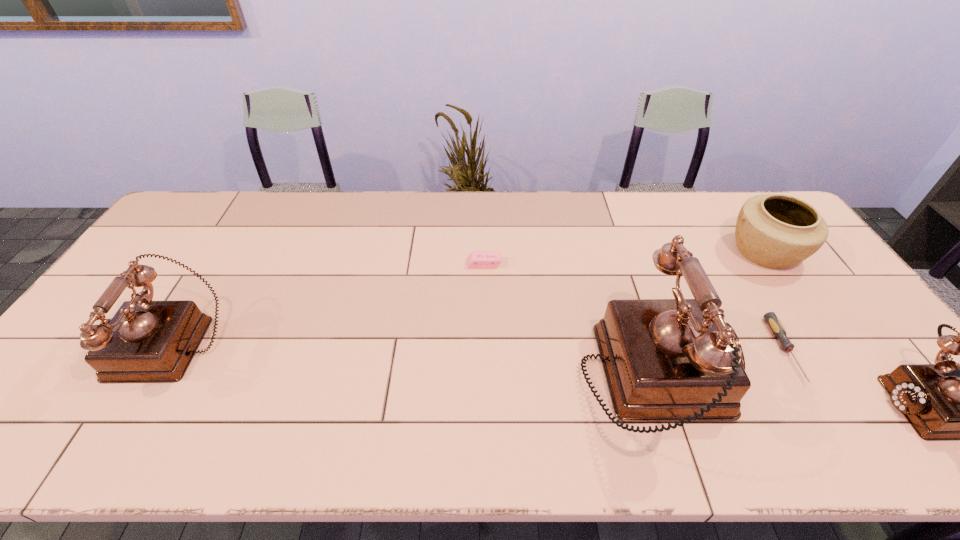
I want to click on free point that satisfies the following two spatial constraints: 1. insert the screwdriver into a screw head; 2. on the dial of the third object from left to right, so click(x=803, y=379).

This screenshot has height=540, width=960. Find the location of `vacant region that satisfies the following two spatial constraints: 1. insert the screwdriver into a screw head; 2. on the dial of the second telephone from right to left`. vacant region that satisfies the following two spatial constraints: 1. insert the screwdriver into a screw head; 2. on the dial of the second telephone from right to left is located at coordinates (803, 379).